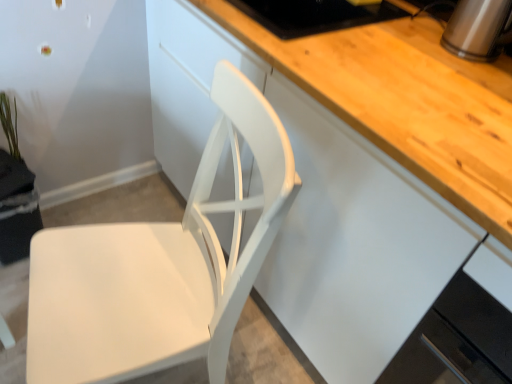
Question: Should I look upward or downward to see white matte cabinet at center, which appears as the 1th cabinetry when viewed from the top?

Choices:
 (A) up
 (B) down

Answer: (A)

Question: Is satin silver kettle at upper right oriented towards green matte plant at upper left?

Choices:
 (A) yes
 (B) no

Answer: (B)

Question: Is green matte plant at upper left surrounded by satin silver kettle at upper right?

Choices:
 (A) yes
 (B) no

Answer: (B)

Question: Is satin silver kettle at upper right bigger than green matte plant at upper left?

Choices:
 (A) no
 (B) yes

Answer: (B)

Question: From a real-world perspective, is satin silver kettle at upper right physically above green matte plant at upper left?

Choices:
 (A) yes
 (B) no

Answer: (A)

Question: Is satin silver kettle at upper right touching green matte plant at upper left?

Choices:
 (A) yes
 (B) no

Answer: (B)

Question: Is satin silver kettle at upper right thinner than green matte plant at upper left?

Choices:
 (A) yes
 (B) no

Answer: (B)

Question: Would you say green matte plant at upper left contains white matte chair at center?

Choices:
 (A) no
 (B) yes

Answer: (A)

Question: Is green matte plant at upper left bigger than white matte chair at center?

Choices:
 (A) no
 (B) yes

Answer: (A)

Question: From the image's perspective, does green matte plant at upper left appear lower than white matte chair at center?

Choices:
 (A) no
 (B) yes

Answer: (A)

Question: Is green matte plant at upper left taller than white matte chair at center?

Choices:
 (A) yes
 (B) no

Answer: (B)

Question: Is green matte plant at upper left facing away from white matte chair at center?

Choices:
 (A) yes
 (B) no

Answer: (B)

Question: Can you see green matte plant at upper left touching white matte chair at center?

Choices:
 (A) no
 (B) yes

Answer: (A)

Question: Is white matte cabinet at center, the second cabinetry when ordered from bottom to top, next to satin silver kettle at upper right and touching it?

Choices:
 (A) no
 (B) yes

Answer: (A)